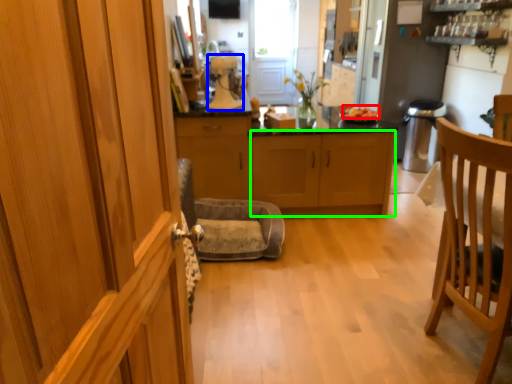
Question: Which object is positioned farthest from food (highlighted by a red box)? Select from kitchen appliance (highlighted by a blue box) and cabinetry (highlighted by a green box).

Choices:
 (A) kitchen appliance
 (B) cabinetry

Answer: (A)